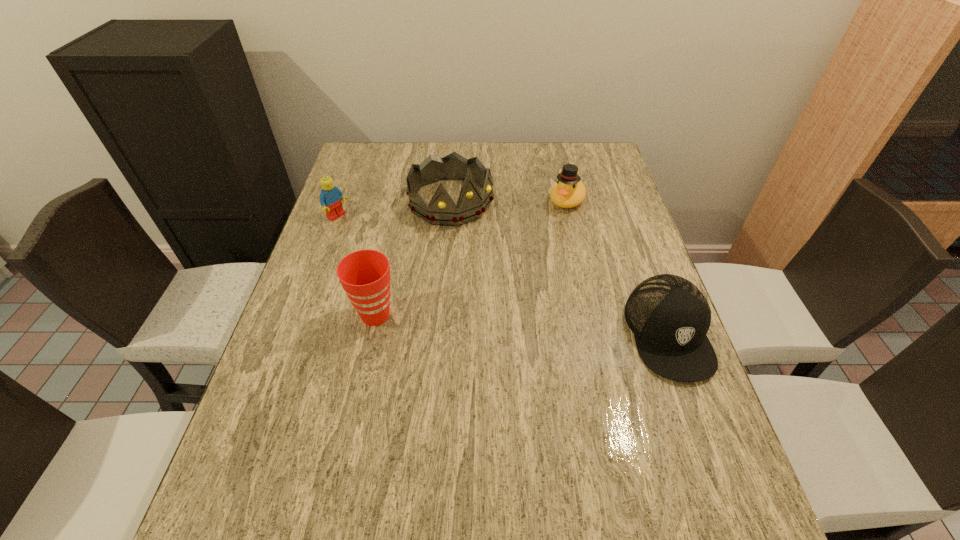
I want to click on vacant area situated on the face of the Lego, so click(440, 286).

The height and width of the screenshot is (540, 960). I want to click on free region located 0.140m on the face of the Lego, so click(x=377, y=244).

Identify the location of vacant space situated 0.070m on the face of the Lego. (361, 233).

This screenshot has height=540, width=960. I want to click on vacant region located 0.060m on the front-facing side of the fourth object from left to right, so click(554, 225).

The height and width of the screenshot is (540, 960). Identify the location of vacant space positioned on the front-facing side of the fourth object from left to right. (523, 273).

Where is `blank space located on the front-facing side of the fourth object from left to right`? The width and height of the screenshot is (960, 540). blank space located on the front-facing side of the fourth object from left to right is located at coordinates [534, 256].

At what (x,y) coordinates should I click in order to perform the action: click on object present at the far edge. Please return your answer as a coordinate pair (x, y). Looking at the image, I should click on pos(441,210).

Where is `cup that is at the left edge`? cup that is at the left edge is located at coordinates (365, 274).

Find the location of a particular element. Image resolution: width=960 pixels, height=540 pixels. Lego at the left edge is located at coordinates (330, 198).

You are a GUI agent. You are given a task and a screenshot of the screen. Output one action in this format:
    pyautogui.click(x=<x>, y=<y>)
    Task: Click on the cap situated at the right edge
    
    Given the screenshot: What is the action you would take?
    [669, 316]